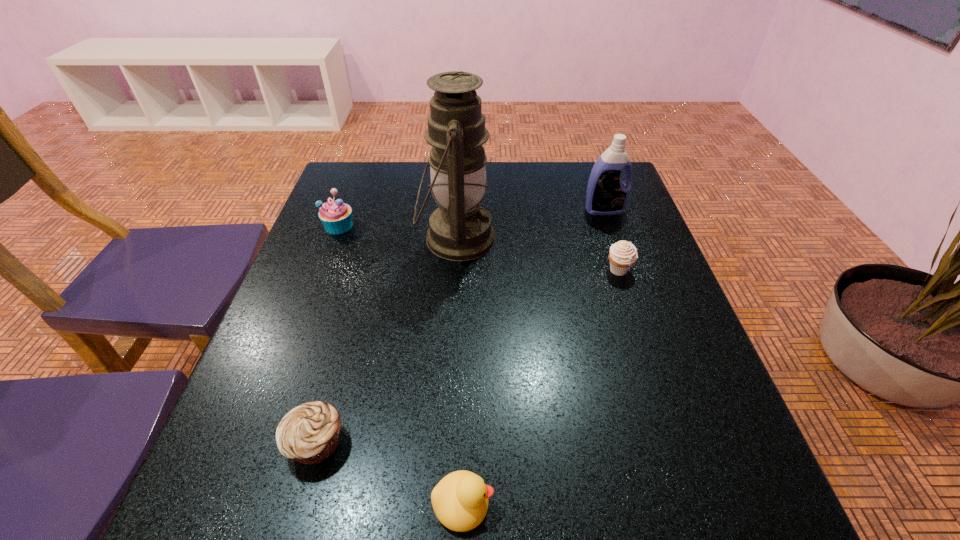
Where is `the tallest object`? Image resolution: width=960 pixels, height=540 pixels. the tallest object is located at coordinates (460, 229).

The image size is (960, 540). I want to click on the fifth shortest object, so click(x=607, y=194).

This screenshot has width=960, height=540. I want to click on the farthest muffin, so click(336, 216).

You are a GUI agent. You are given a task and a screenshot of the screen. Output one action in this format:
    pyautogui.click(x=<x>, y=<y>)
    Task: Click on the leftmost object
    
    Given the screenshot: What is the action you would take?
    click(336, 216)

Find the location of `the rightmost muffin`. the rightmost muffin is located at coordinates (623, 254).

The height and width of the screenshot is (540, 960). Find the location of `the fifth farthest object`. the fifth farthest object is located at coordinates (310, 433).

I want to click on the second object from left to right, so click(310, 433).

Image resolution: width=960 pixels, height=540 pixels. In order to click on duckling in this screenshot , I will do `click(460, 500)`.

What are the coordinates of `vacant region located on the right of the oil lamp` in the screenshot? It's located at (613, 239).

The image size is (960, 540). Identify the location of vacant area located 0.200m on the left of the detergent. (511, 210).